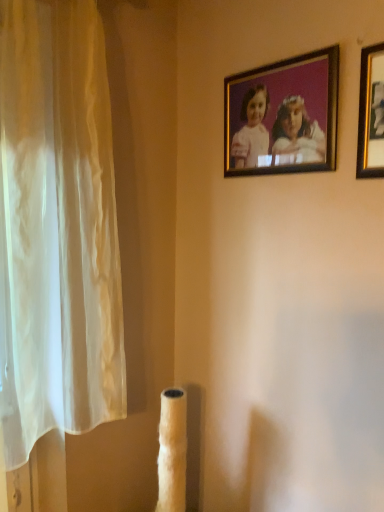
Question: Considering the positions of gold-framed photo at upper center, marked as the second picture frame in a front-to-back arrangement, and gold-framed picture at upper right, which appears as the 2th picture frame when viewed from the left, in the image, is gold-framed photo at upper center, marked as the second picture frame in a front-to-back arrangement, wider or thinner than gold-framed picture at upper right, which appears as the 2th picture frame when viewed from the left,?

Choices:
 (A) thin
 (B) wide

Answer: (B)

Question: Do you think gold-framed photo at upper center, the first picture frame when ordered from left to right, is within gold-framed picture at upper right, which appears as the 2th picture frame when viewed from the left, or outside of it?

Choices:
 (A) outside
 (B) inside

Answer: (A)

Question: Considering the positions of point (331, 124) and point (377, 59), is point (331, 124) closer or farther from the camera than point (377, 59)?

Choices:
 (A) closer
 (B) farther

Answer: (B)

Question: Considering their positions, is gold-framed picture at upper right, which is counted as the 1th picture frame, starting from the front, located in front of or behind gold-framed photo at upper center, the first picture frame when ordered from left to right?

Choices:
 (A) front
 (B) behind

Answer: (A)

Question: Would you say gold-framed picture at upper right, which ranks as the 2th picture frame in back-to-front order, is inside or outside gold-framed photo at upper center, marked as the second picture frame in a front-to-back arrangement?

Choices:
 (A) outside
 (B) inside

Answer: (A)

Question: Is point (360, 108) closer or farther from the camera than point (248, 114)?

Choices:
 (A) closer
 (B) farther

Answer: (A)

Question: Based on their positions, is gold-framed picture at upper right, which ranks as the 2th picture frame in back-to-front order, located to the left or right of gold-framed photo at upper center, the first picture frame when ordered from left to right?

Choices:
 (A) right
 (B) left

Answer: (A)